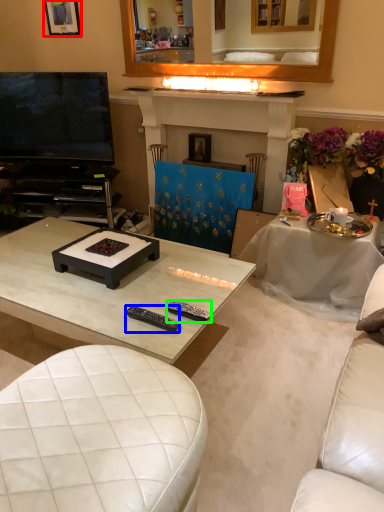
Question: Estimate the real-world distances between objects in this image. Which object is closer to picture frame (highlighted by a red box), remote control (highlighted by a blue box) or remote control (highlighted by a green box)?

Choices:
 (A) remote control
 (B) remote control

Answer: (A)